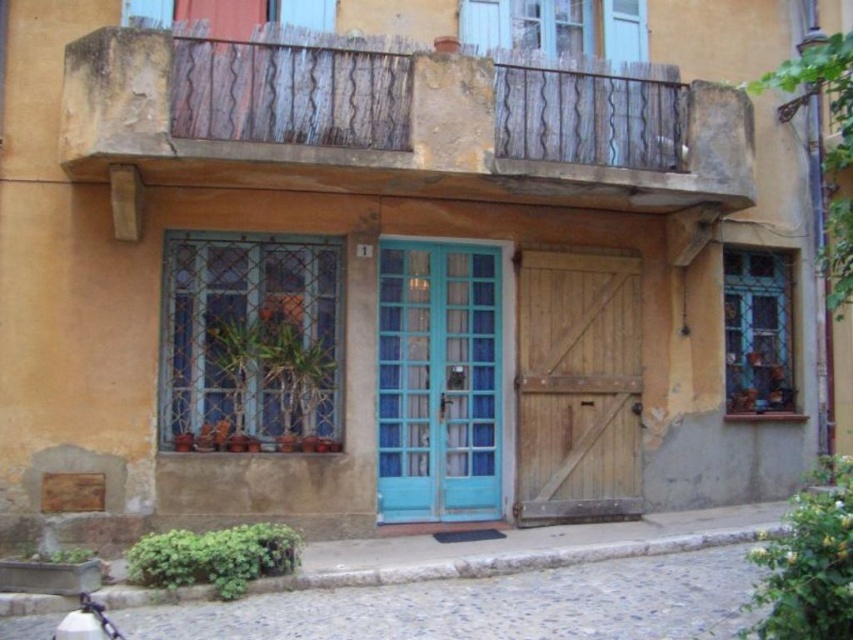
Question: Which point appears farthest from the camera in this image?

Choices:
 (A) (637, 492)
 (B) (492, 397)
 (C) (126, 145)

Answer: (A)

Question: In this image, where is weathered wood at upper center located relative to wooden plank door at center?

Choices:
 (A) left
 (B) right

Answer: (A)

Question: Estimate the real-world distances between objects in this image. Which object is farther from the weathered wood at upper center?

Choices:
 (A) wooden plank door at center
 (B) teal glass door at center

Answer: (A)

Question: Does teal glass door at center have a smaller size compared to wooden plank door at center?

Choices:
 (A) no
 (B) yes

Answer: (B)

Question: Among these points, which one is nearest to the camera?

Choices:
 (A) (479, 424)
 (B) (628, 284)
 (C) (737, 125)

Answer: (C)

Question: Is weathered wood at upper center above teal glass door at center?

Choices:
 (A) yes
 (B) no

Answer: (A)